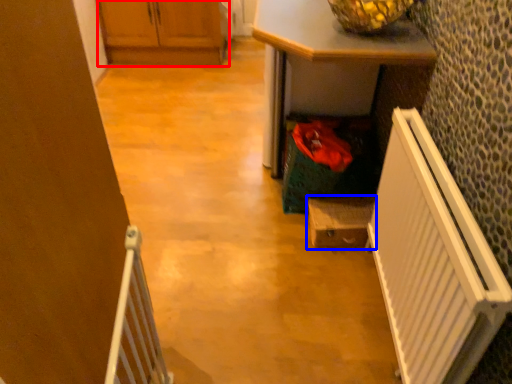
Question: Which object is closer to the camera taking this photo, cabinetry (highlighted by a red box) or cabinetry (highlighted by a blue box)?

Choices:
 (A) cabinetry
 (B) cabinetry

Answer: (B)